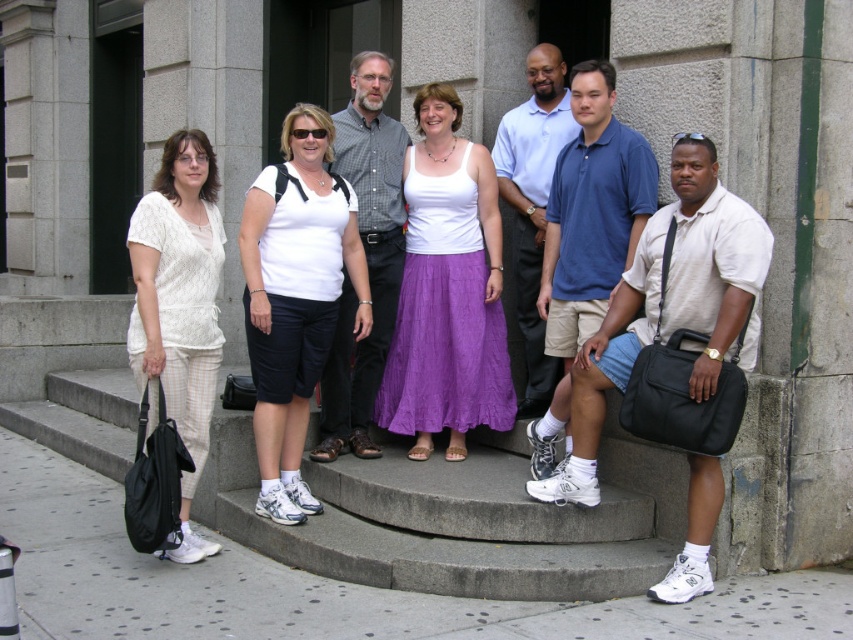
You are standing on the gray concrete stairs at lower center and want to reach the white cotton shirt at center. Which direction should you move to get closer to it?

The gray concrete stairs at lower center are located below the white cotton shirt at center, so you should move upward to reach it.

From the picture: You are organizing a charity event and need to display two shirts on a single mannequin. The mannequin has a limited space. Given the white cotton tank top at center and the white cotton polo shirt at center, which one requires more space on the mannequin due to its size?

The white cotton tank top at center requires more space on the mannequin because its width is larger than the white cotton polo shirt at center.

You are a photographer trying to capture a group photo of the seven adults on the gray concrete stairs at lower center and the white cotton shirt at center. Which object is shorter in height?

The gray concrete stairs at lower center is not as tall as the white cotton shirt at center, so the stairs are shorter in height.